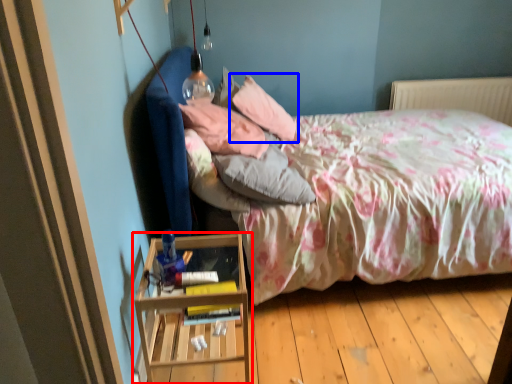
Question: Which object appears farthest to the camera in this image, nightstand (highlighted by a red box) or pillow (highlighted by a blue box)?

Choices:
 (A) nightstand
 (B) pillow

Answer: (B)